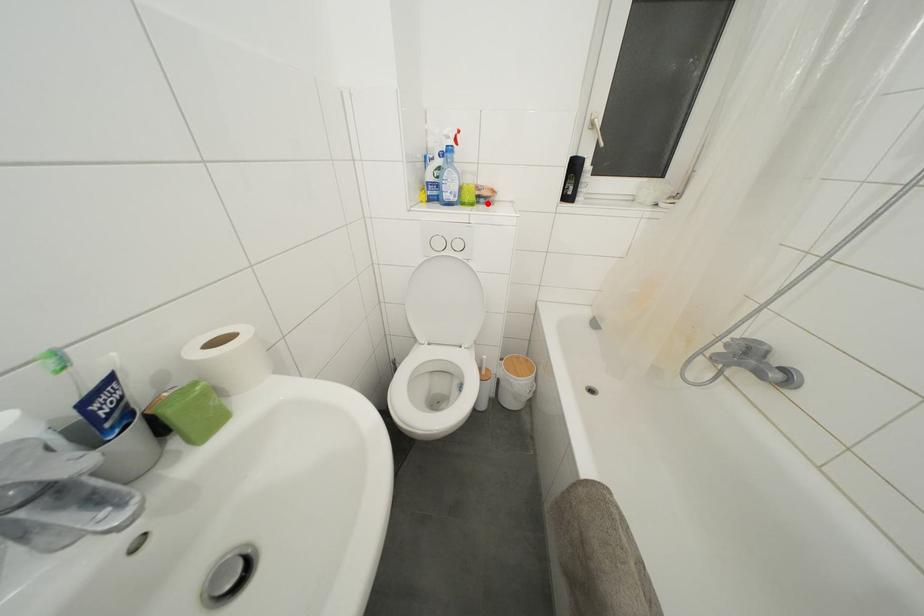
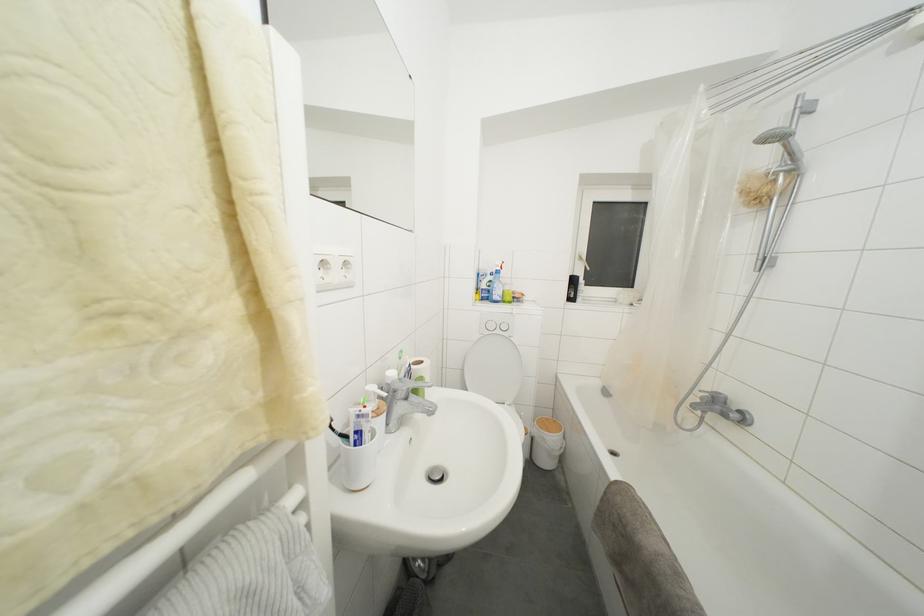
Question: I am providing you with two images of the same scene from different viewpoints. A red point is marked on the first image. Can you still see the location of the red point in image 2?

Choices:
 (A) Yes
 (B) No

Answer: (A)